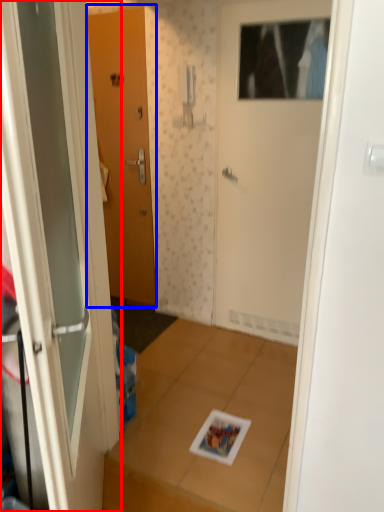
Question: Which object appears farthest to the camera in this image, door (highlighted by a red box) or door (highlighted by a blue box)?

Choices:
 (A) door
 (B) door

Answer: (B)